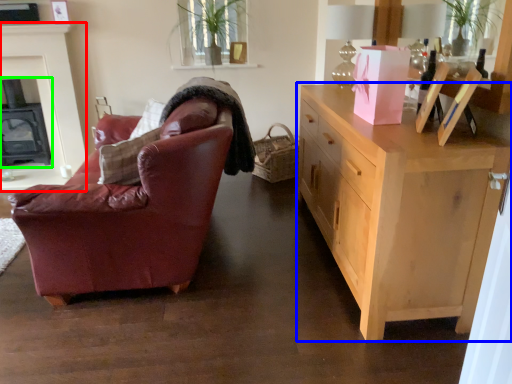
Question: Considering the real-world distances, which object is closest to fireplace (highlighted by a red box)? cabinetry (highlighted by a blue box) or fireplace (highlighted by a green box).

Choices:
 (A) cabinetry
 (B) fireplace

Answer: (B)